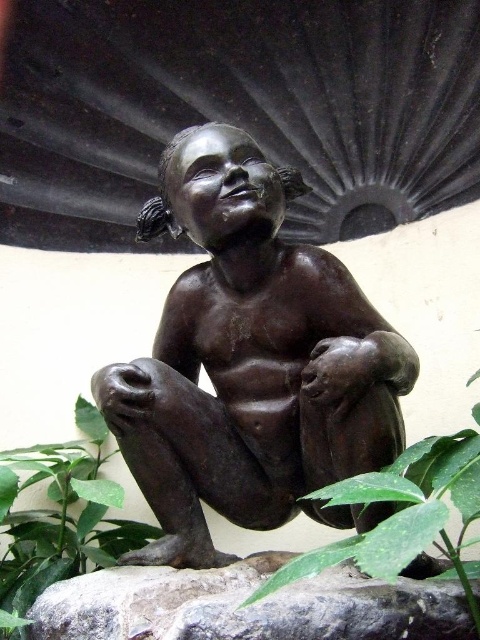
Between bronze statue at center and green leafy plant at lower center, which one has more height?

Standing taller between the two is bronze statue at center.

This screenshot has height=640, width=480. I want to click on bronze statue at center, so click(251, 362).

This screenshot has width=480, height=640. I want to click on bronze statue at center, so point(251,362).

How distant is bronze statue at center from gray rough stone at lower center?

bronze statue at center is 34.22 inches away from gray rough stone at lower center.

Is bronze statue at center to the right of gray rough stone at lower center from the viewer's perspective?

No, bronze statue at center is not to the right of gray rough stone at lower center.

Which is behind, point (193, 147) or point (253, 572)?

The point (193, 147) is more distant.

At what (x,y) coordinates should I click in order to perform the action: click on bronze statue at center. Please return your answer as a coordinate pair (x, y). Image resolution: width=480 pixels, height=640 pixels. Looking at the image, I should click on (251, 362).

Does bronze statue at center appear over green leafy plant at lower left?

Yes.

Who is more distant from viewer, (242, 266) or (0, 524)?

The point (0, 524) is behind.

The width and height of the screenshot is (480, 640). I want to click on bronze statue at center, so click(251, 362).